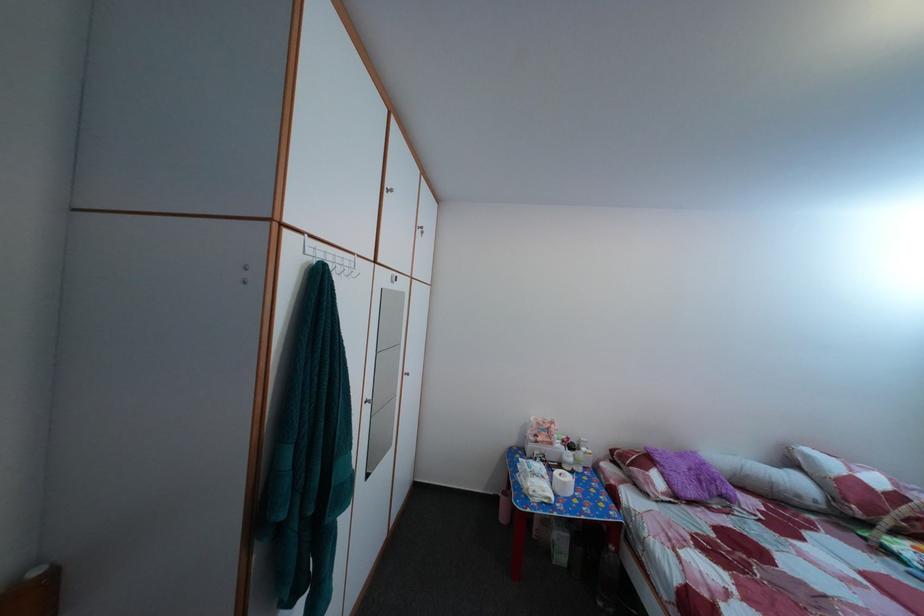
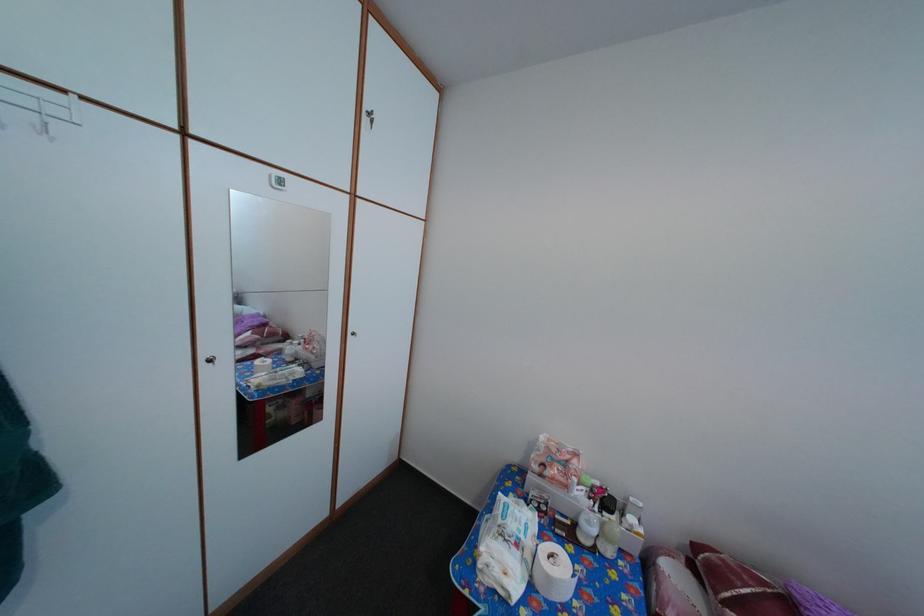
Find the pixel in the second image that matches (575,466) in the first image.

(592, 531)